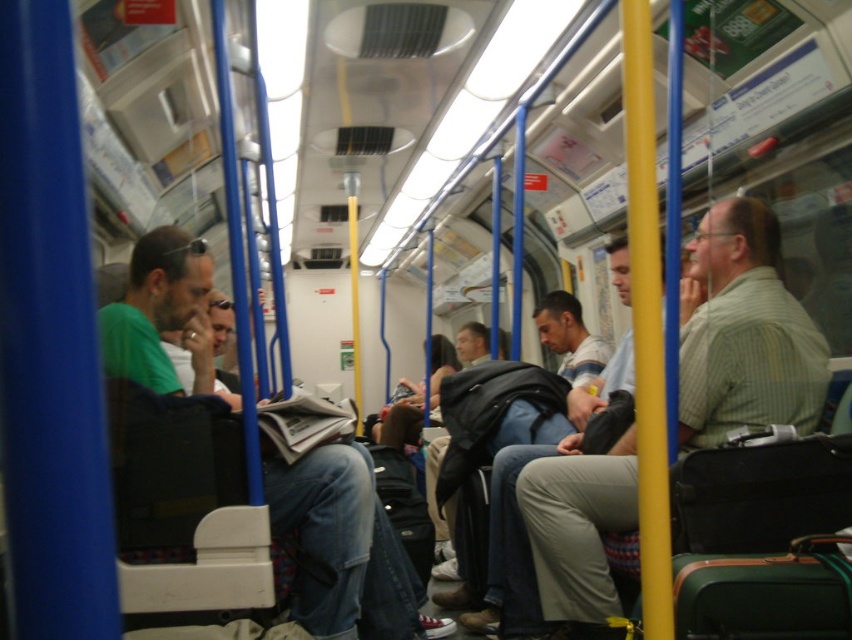
Question: Does light green striped shirt at right have a lesser width compared to light gray pants at center?

Choices:
 (A) no
 (B) yes

Answer: (A)

Question: Estimate the real-world distances between objects in this image. Which object is closer to the dark blue jeans at center?

Choices:
 (A) light green striped shirt at right
 (B) light gray pants at center
 (C) matte gray backpack at center
 (D) green cotton shirt at left

Answer: (C)

Question: Is light green striped shirt at right to the right of green cotton shirt at left from the viewer's perspective?

Choices:
 (A) no
 (B) yes

Answer: (B)

Question: Which point is closer to the camera taking this photo?

Choices:
 (A) (493, 628)
 (B) (544, 476)

Answer: (B)

Question: Does light green striped shirt at right appear on the right side of dark blue jeans at center?

Choices:
 (A) yes
 (B) no

Answer: (A)

Question: Among these points, which one is farthest from the camera?

Choices:
 (A) (499, 572)
 (B) (620, 502)
 (C) (563, 376)
 (D) (393, 625)

Answer: (C)